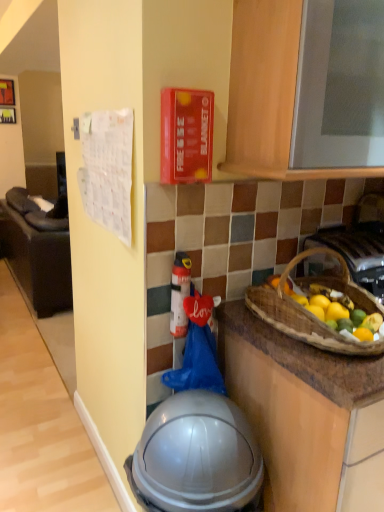
At what (x,y) coordinates should I click in order to perform the action: click on transparent plastic helmet at lower center. Please return your answer as a coordinate pair (x, y). Image resolution: width=384 pixels, height=512 pixels. Looking at the image, I should click on pyautogui.click(x=196, y=456).

Measure the distance between metallic silver gas stove at right and camera.

metallic silver gas stove at right and camera are 1.29 meters apart.

What are the coordinates of `white fabric calendar at left` in the screenshot? It's located at (37, 253).

Identify the location of transparent plastic helmet at lower center. Image resolution: width=384 pixels, height=512 pixels. (196, 456).

Considering the sizes of objects metallic silver gas stove at right and transparent plastic helmet at lower center in the image provided, who is taller, metallic silver gas stove at right or transparent plastic helmet at lower center?

Standing taller between the two is transparent plastic helmet at lower center.

What's the angular difference between metallic silver gas stove at right and transparent plastic helmet at lower center's facing directions?

There is a 2.82-degree angle between the facing directions of metallic silver gas stove at right and transparent plastic helmet at lower center.

Can transparent plastic helmet at lower center be found inside metallic silver gas stove at right?

That's incorrect, transparent plastic helmet at lower center is not inside metallic silver gas stove at right.

Where is `gas stove that is above the transparent plastic helmet at lower center (from a real-world perspective)`? Image resolution: width=384 pixels, height=512 pixels. gas stove that is above the transparent plastic helmet at lower center (from a real-world perspective) is located at coordinates (356, 252).

Does wooden cabinet at upper center have a smaller size compared to transparent plastic helmet at lower center?

Incorrect, wooden cabinet at upper center is not smaller in size than transparent plastic helmet at lower center.

From the image's perspective, is wooden cabinet at upper center above transparent plastic helmet at lower center?

Yes, from the image's perspective, wooden cabinet at upper center is on top of transparent plastic helmet at lower center.

Can you confirm if wooden cabinet at upper center is shorter than transparent plastic helmet at lower center?

Yes.

Is wooden cabinet at upper center further to the viewer compared to transparent plastic helmet at lower center?

That is False.

Do you think white fabric calendar at left is within metallic silver gas stove at right, or outside of it?

white fabric calendar at left is spatially situated outside metallic silver gas stove at right.

From the image's perspective, is white fabric calendar at left positioned above or below metallic silver gas stove at right?

white fabric calendar at left is situated higher than metallic silver gas stove at right in the image.

Can you tell me how much white fabric calendar at left and metallic silver gas stove at right differ in facing direction?

The angular difference between white fabric calendar at left and metallic silver gas stove at right is 91 degrees.

Which of these two, white fabric calendar at left or metallic silver gas stove at right, is wider?

Wider between the two is white fabric calendar at left.

Can you tell me how much white fabric calendar at left and transparent plastic helmet at lower center differ in facing direction?

The angle between the facing direction of white fabric calendar at left and the facing direction of transparent plastic helmet at lower center is 88.1 degrees.

Is white fabric calendar at left oriented towards transparent plastic helmet at lower center?

No, white fabric calendar at left is not oriented towards transparent plastic helmet at lower center.

Can you confirm if white fabric calendar at left is taller than transparent plastic helmet at lower center?

Correct, white fabric calendar at left is much taller as transparent plastic helmet at lower center.

Looking at their sizes, would you say white fabric calendar at left is wider or thinner than transparent plastic helmet at lower center?

Clearly, white fabric calendar at left has more width compared to transparent plastic helmet at lower center.

Between transparent plastic helmet at lower center and wooden cabinet at upper center, which one has smaller size?

transparent plastic helmet at lower center.

Which of these two, transparent plastic helmet at lower center or wooden cabinet at upper center, is wider?

Wider between the two is transparent plastic helmet at lower center.

Is point (181, 433) closer to camera compared to point (285, 25)?

No, it is not.

The height and width of the screenshot is (512, 384). I want to click on cabinetry on the right side of transparent plastic helmet at lower center, so click(x=267, y=93).

How many degrees apart are the facing directions of transparent plastic helmet at lower center and metallic silver gas stove at right?

The angle between the facing direction of transparent plastic helmet at lower center and the facing direction of metallic silver gas stove at right is 2.82 degrees.

From a real-world perspective, which is physically below, transparent plastic helmet at lower center or metallic silver gas stove at right?

transparent plastic helmet at lower center.

Can you confirm if transparent plastic helmet at lower center is shorter than metallic silver gas stove at right?

No, transparent plastic helmet at lower center is not shorter than metallic silver gas stove at right.

This screenshot has width=384, height=512. Find the location of `helmet that is under the metallic silver gas stove at right (from a real-world perspective)`. helmet that is under the metallic silver gas stove at right (from a real-world perspective) is located at coordinates [196, 456].

Is point (348, 281) positioned behind point (182, 506)?

That is True.

Looking at this image, is brown woven basket at right facing towards transparent plastic helmet at lower center?

No, brown woven basket at right is not facing towards transparent plastic helmet at lower center.

Who is smaller, brown woven basket at right or transparent plastic helmet at lower center?

brown woven basket at right.

The image size is (384, 512). What are the coordinates of `helmet lying on the left of metallic silver gas stove at right` in the screenshot? It's located at (196, 456).

This screenshot has height=512, width=384. What are the coordinates of `cabinetry lying in front of the transparent plastic helmet at lower center` in the screenshot? It's located at (267, 93).

Estimate the real-world distances between objects in this image. Which object is closer to wooden cabinet at upper center, brown woven basket at right or transparent plastic helmet at lower center?

Among the two, brown woven basket at right is located nearer to wooden cabinet at upper center.

Based on their spatial positions, is metallic silver gas stove at right or wooden cabinet at upper center closer to transparent plastic helmet at lower center?

metallic silver gas stove at right is positioned closer to the anchor transparent plastic helmet at lower center.

Based on their spatial positions, is wooden cabinet at upper center or white fabric calendar at left closer to transparent plastic helmet at lower center?

wooden cabinet at upper center lies closer to transparent plastic helmet at lower center than the other object.

Which object lies nearer to the anchor point transparent plastic helmet at lower center, wooden cabinet at upper center or metallic silver gas stove at right?

metallic silver gas stove at right lies closer to transparent plastic helmet at lower center than the other object.

Estimate the real-world distances between objects in this image. Which object is further from metallic silver gas stove at right, brown woven basket at right or white fabric calendar at left?

white fabric calendar at left lies further to metallic silver gas stove at right than the other object.

Looking at the image, which one is located closer to wooden cabinet at upper center, white fabric calendar at left or metallic silver gas stove at right?

metallic silver gas stove at right.

Which object lies further to the anchor point white fabric calendar at left, transparent plastic helmet at lower center or brown woven basket at right?

brown woven basket at right is further to white fabric calendar at left.

Which object lies nearer to the anchor point brown woven basket at right, wooden cabinet at upper center or white fabric calendar at left?

wooden cabinet at upper center is closer to brown woven basket at right.

Locate an element on the screen. helmet between wooden cabinet at upper center and white fabric calendar at left in the front-back direction is located at coordinates (196, 456).

Where is `gas stove between wooden cabinet at upper center and brown woven basket at right in the vertical direction`? The image size is (384, 512). gas stove between wooden cabinet at upper center and brown woven basket at right in the vertical direction is located at coordinates [x=356, y=252].

Locate an element on the screen. The width and height of the screenshot is (384, 512). picnic basket that lies between metallic silver gas stove at right and transparent plastic helmet at lower center from top to bottom is located at coordinates (310, 312).

Find the location of a particular element. This screenshot has width=384, height=512. gas stove positioned between brown woven basket at right and white fabric calendar at left from near to far is located at coordinates (356, 252).